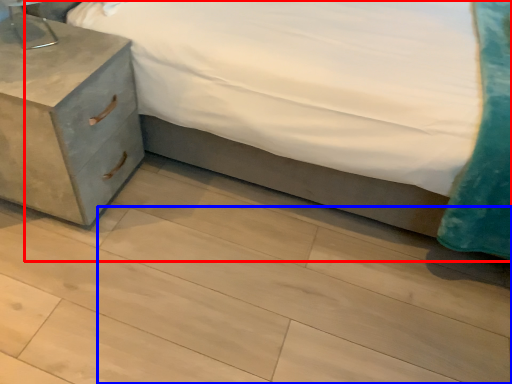
Question: Which object appears closest to the camera in this image, bed (highlighted by a red box) or tile (highlighted by a blue box)?

Choices:
 (A) bed
 (B) tile

Answer: (A)